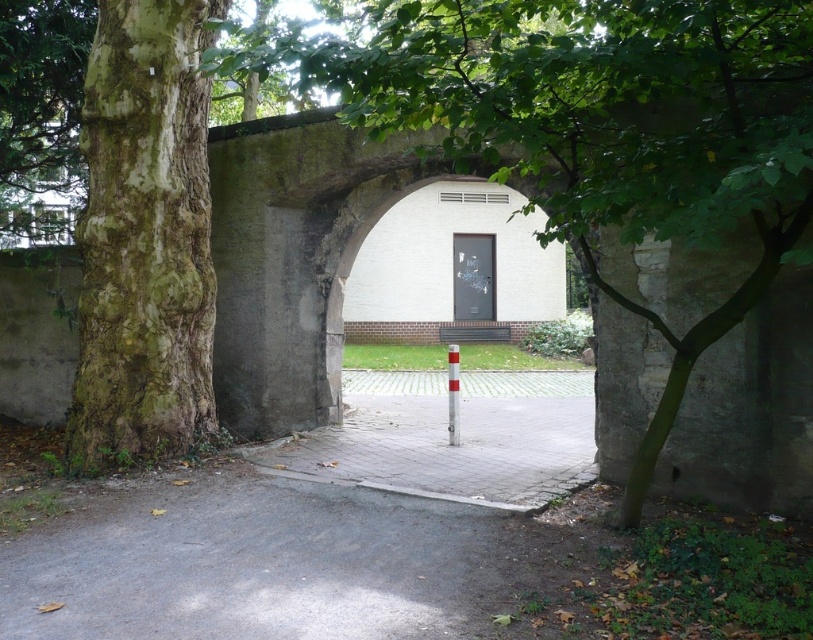
Based on the photo, you are standing in front of the stone archway and see a green leafy tree at center. There is a point marked at coordinates (x=598, y=129). Where is this point located?

The point at (x=598, y=129) is located on the green leafy tree at center.

You are standing at the entrance of the stone archway and want to walk through the paved stone alley at center. There is a green leafy tree at center blocking your path. Can you walk under the tree to enter the alley?

The green leafy tree at center is taller than the paved stone alley at center, so you can walk under the tree to enter the alley since the tree is taller and likely allows enough clearance.

You are standing in front of the stone archway and want to take a photo of the green leafy tree at center. Where should you position yourself to capture the tree in the center of your camera frame?

To capture the green leafy tree at center in the center of your camera frame, position yourself directly in front of the stone archway, as the tree is already located at the central point with coordinates approximately at 0.203 on the x and 0.736 on the y axis.